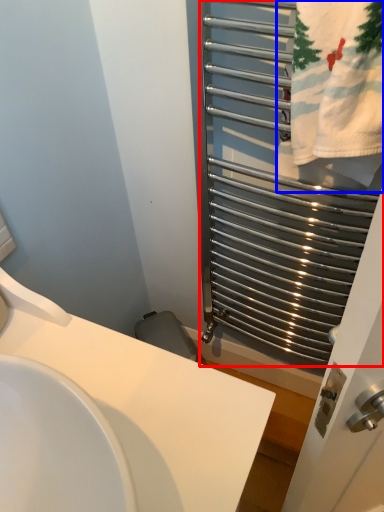
Question: Which point is further to the camera, cage (highlighted by a red box) or bath towel (highlighted by a blue box)?

Choices:
 (A) cage
 (B) bath towel

Answer: (B)